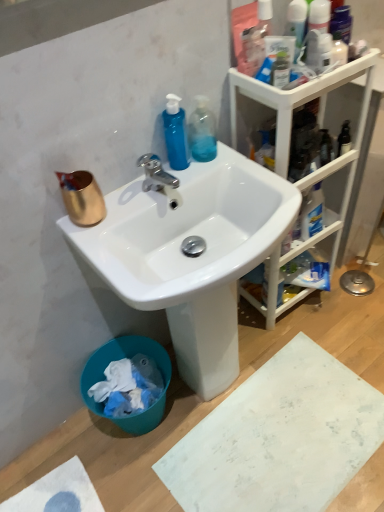
The width and height of the screenshot is (384, 512). What are the coordinates of `vacant space to the right of blue translucent bottle at upper center, positioned as the 2th cleaning product in right-to-left order` in the screenshot? It's located at (220, 161).